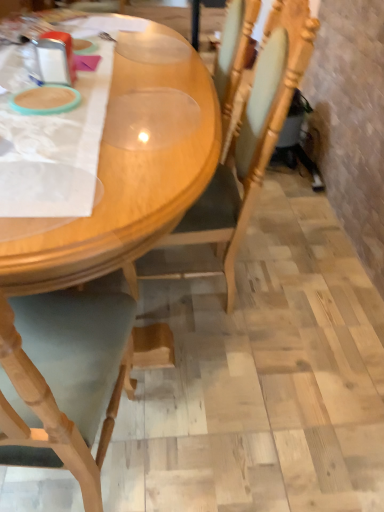
Question: Is wooden table at center positioned behind wooden chair at center?

Choices:
 (A) yes
 (B) no

Answer: (B)

Question: Does wooden table at center have a greater width compared to wooden chair at center?

Choices:
 (A) no
 (B) yes

Answer: (B)

Question: Is wooden table at center far from wooden chair at center?

Choices:
 (A) no
 (B) yes

Answer: (A)

Question: Is wooden table at center facing towards wooden chair at center?

Choices:
 (A) yes
 (B) no

Answer: (A)

Question: From the image's perspective, is wooden table at center on top of wooden chair at center?

Choices:
 (A) yes
 (B) no

Answer: (A)

Question: From a real-world perspective, is wooden table at center located higher than wooden chair at center?

Choices:
 (A) no
 (B) yes

Answer: (A)

Question: Does wooden chair at center have a lesser height compared to wooden table at center?

Choices:
 (A) yes
 (B) no

Answer: (B)

Question: From a real-world perspective, is wooden chair at center over wooden table at center?

Choices:
 (A) no
 (B) yes

Answer: (B)

Question: Could you tell me if wooden chair at center is turned towards wooden table at center?

Choices:
 (A) no
 (B) yes

Answer: (B)

Question: Is wooden table at center inside wooden chair at center?

Choices:
 (A) no
 (B) yes

Answer: (A)

Question: From a real-world perspective, is wooden chair at center positioned under wooden table at center based on gravity?

Choices:
 (A) no
 (B) yes

Answer: (A)

Question: Can you confirm if wooden chair at center is positioned to the left of wooden table at center?

Choices:
 (A) no
 (B) yes

Answer: (A)

Question: Is wooden chair at center taller or shorter than wooden table at center?

Choices:
 (A) tall
 (B) short

Answer: (A)